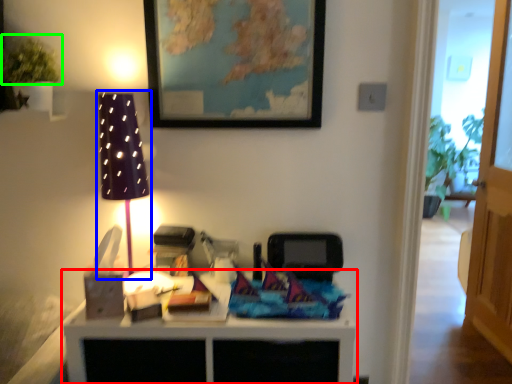
Question: Estimate the real-world distances between objects in this image. Which object is farther from table (highlighted by a red box), table lamp (highlighted by a blue box) or plant (highlighted by a green box)?

Choices:
 (A) table lamp
 (B) plant

Answer: (B)